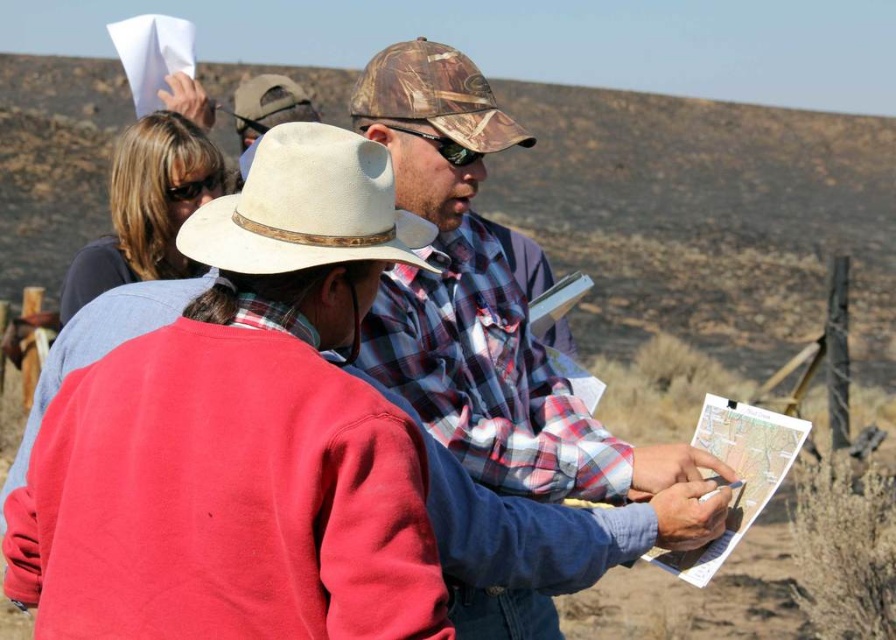
Consider the image. You are a hiker trying to navigate using the map in the image. You see the camouflage fabric cowboy hat at center and the white paper map at center. Which object is positioned higher in the image?

The camouflage fabric cowboy hat at center is above the white paper map at center, so it is positioned higher in the image.